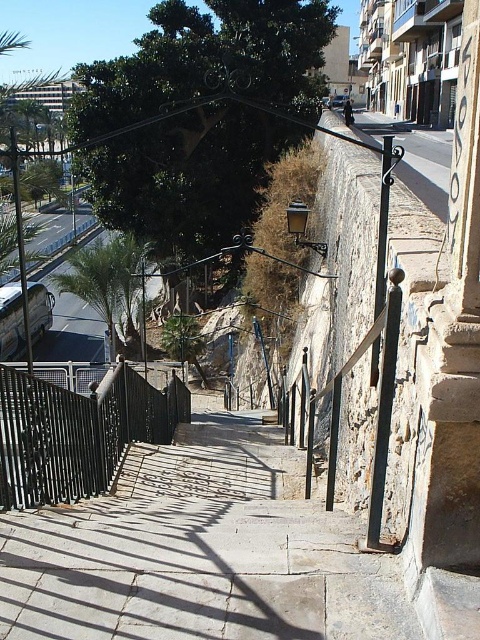
In the scene shown: You are a delivery person carrying a large package and need to navigate the stairs in the image. The package is 2.5 meters long. Can you safely carry it down the smooth stone steps at center without it getting stuck?

The distance between the smooth stone steps at center and the camera is 2.73 meters. Since the package is 2.5 meters long, it should fit within the available space, allowing you to safely carry it down the smooth stone steps at center without it getting stuck.

You are a delivery person carrying a heavy box and need to descend the stairs. You notice the smooth stone steps at center and the black wrought iron railing at center. Which object should you hold onto for better stability?

You should hold onto the black wrought iron railing at center for better stability because the smooth stone steps at center are in front of it, meaning the railing is positioned where you can grasp it while descending.